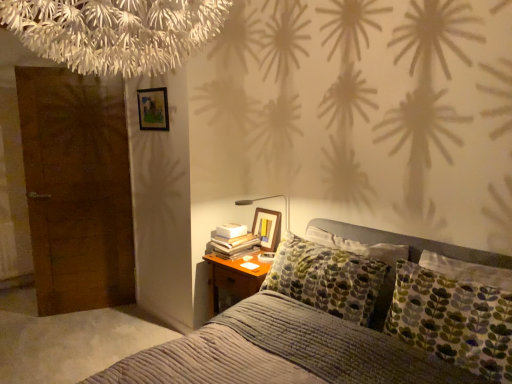
What do you see at coordinates (115, 32) in the screenshot? I see `white fringed chandelier at upper center` at bounding box center [115, 32].

Describe the element at coordinates (153, 109) in the screenshot. Image resolution: width=512 pixels, height=384 pixels. I see `wooden picture frame at upper left, acting as the 2th picture frame starting from the bottom` at that location.

Where is `textured gray bed at center`? textured gray bed at center is located at coordinates (281, 352).

Where is `brown wooden door at left`? This screenshot has height=384, width=512. brown wooden door at left is located at coordinates (77, 189).

You are a GUI agent. You are given a task and a screenshot of the screen. Output one action in this format:
    pyautogui.click(x=<x>, y=<y>)
    Task: Click on the white fringed chandelier at upper center
    Image resolution: width=512 pixels, height=384 pixels.
    Given the screenshot: What is the action you would take?
    pyautogui.click(x=115, y=32)

Considering the sizes of objects white paper book at bedside and textured gray bed at center in the image provided, who is wider, white paper book at bedside or textured gray bed at center?

With larger width is textured gray bed at center.

From a real-world perspective, who is located higher, white paper book at bedside or textured gray bed at center?

In real-world perspective, white paper book at bedside is above.

From the image's perspective, which is above, white paper book at bedside or textured gray bed at center?

white paper book at bedside appears higher in the image.

Between white paper book at bedside and textured gray bed at center, which one has less height?

With less height is white paper book at bedside.

Is textured gray bed at center outside of wooden picture frame at upper right, placed as the second picture frame when sorted from top to bottom?

That's correct, textured gray bed at center is outside of wooden picture frame at upper right, placed as the second picture frame when sorted from top to bottom.

Between textured gray bed at center and wooden picture frame at upper right, arranged as the 1th picture frame when ordered from the bottom, which one has larger width?

With larger width is textured gray bed at center.

Are textured gray bed at center and wooden picture frame at upper right, arranged as the 1th picture frame when ordered from the bottom, beside each other?

No, textured gray bed at center is not touching wooden picture frame at upper right, arranged as the 1th picture frame when ordered from the bottom.

This screenshot has width=512, height=384. Identify the location of bed that appears on the left of wooden picture frame at upper right, arranged as the 1th picture frame when ordered from the bottom. (281, 352).

Considering the relative positions of textured gray bed at center and wooden picture frame at upper left, placed as the 1th picture frame when sorted from left to right, in the image provided, is textured gray bed at center to the left of wooden picture frame at upper left, placed as the 1th picture frame when sorted from left to right, from the viewer's perspective?

No, textured gray bed at center is not to the left of wooden picture frame at upper left, placed as the 1th picture frame when sorted from left to right.

Does textured gray bed at center have a greater height compared to wooden picture frame at upper left, which appears as the first picture frame when viewed from the top?

Correct, textured gray bed at center is much taller as wooden picture frame at upper left, which appears as the first picture frame when viewed from the top.

Is textured gray bed at center bigger or smaller than wooden picture frame at upper left, placed as the 1th picture frame when sorted from left to right?

Considering their sizes, textured gray bed at center takes up more space than wooden picture frame at upper left, placed as the 1th picture frame when sorted from left to right.

In the scene shown: Between textured gray bed at center and wooden picture frame at upper left, which appears as the first picture frame when viewed from the top, which one is positioned behind?

Positioned behind is wooden picture frame at upper left, which appears as the first picture frame when viewed from the top.

Is white paper book at bedside next to wooden picture frame at upper left, which appears as the first picture frame when viewed from the top?

No, white paper book at bedside is not in contact with wooden picture frame at upper left, which appears as the first picture frame when viewed from the top.

Is the position of white paper book at bedside less distant than that of wooden picture frame at upper left, which appears as the first picture frame when viewed from the top?

Yes, white paper book at bedside is closer to the viewer.

Does white paper book at bedside have a lesser height compared to wooden picture frame at upper left, the second picture frame positioned from the right?

Yes.

What's the angular difference between white paper book at bedside and wooden picture frame at upper left, placed as the 1th picture frame when sorted from left to right,'s facing directions?

There is a 2.02-degree angle between the facing directions of white paper book at bedside and wooden picture frame at upper left, placed as the 1th picture frame when sorted from left to right.

In the scene shown: What's the angular difference between brown wooden door at left and wooden picture frame at upper right, arranged as the 1th picture frame when ordered from the bottom,'s facing directions?

The angular difference between brown wooden door at left and wooden picture frame at upper right, arranged as the 1th picture frame when ordered from the bottom, is 66.6 degrees.

Can you confirm if brown wooden door at left is bigger than wooden picture frame at upper right, arranged as the 1th picture frame when ordered from the bottom?

Yes.

From their relative heights in the image, would you say brown wooden door at left is taller or shorter than wooden picture frame at upper right, arranged as the 1th picture frame when ordered from the bottom?

brown wooden door at left is taller than wooden picture frame at upper right, arranged as the 1th picture frame when ordered from the bottom.

Which object is more forward, brown wooden door at left or wooden picture frame at upper right, arranged as the second picture frame when viewed from the left?

→ wooden picture frame at upper right, arranged as the second picture frame when viewed from the left.

Based on the photo, from the image's perspective, is textured gray bed at center located above or below brown wooden door at left?

From the image's perspective, textured gray bed at center appears below brown wooden door at left.

Is textured gray bed at center aimed at brown wooden door at left?

No, textured gray bed at center is not aimed at brown wooden door at left.

In terms of width, does textured gray bed at center look wider or thinner when compared to brown wooden door at left?

textured gray bed at center is wider than brown wooden door at left.

Which is more to the right, textured gray bed at center or brown wooden door at left?

Positioned to the right is textured gray bed at center.

From the image's perspective, which is above, white fringed chandelier at upper center or wooden picture frame at upper right, arranged as the 1th picture frame when ordered from the bottom?

white fringed chandelier at upper center.

Between white fringed chandelier at upper center and wooden picture frame at upper right, placed as the second picture frame when sorted from top to bottom, which one appears on the left side from the viewer's perspective?

From the viewer's perspective, white fringed chandelier at upper center appears more on the left side.

Is wooden picture frame at upper right, which is the 1th picture frame from right to left, at the back of white fringed chandelier at upper center?

That's not correct — white fringed chandelier at upper center is not looking away from wooden picture frame at upper right, which is the 1th picture frame from right to left.

Image resolution: width=512 pixels, height=384 pixels. In order to click on book on the left of the textured gray bed at center in this screenshot , I will do `click(233, 242)`.

There is a textured gray bed at center. Identify the location of the 1st picture frame above it (from a real-world perspective). (267, 228).

Looking at the image, which one is located closer to textured gray bed at center, wooden picture frame at upper right, which is the 1th picture frame from right to left, or white fringed chandelier at upper center?

The object closer to textured gray bed at center is wooden picture frame at upper right, which is the 1th picture frame from right to left.

Estimate the real-world distances between objects in this image. Which object is closer to brown wooden door at left, textured gray bed at center or wooden picture frame at upper left, the second picture frame positioned from the right?

wooden picture frame at upper left, the second picture frame positioned from the right, lies closer to brown wooden door at left than the other object.

Based on their spatial positions, is wooden picture frame at upper left, which appears as the first picture frame when viewed from the top, or textured gray bed at center closer to white fringed chandelier at upper center?

Among the two, textured gray bed at center is located nearer to white fringed chandelier at upper center.

From the image, which object appears to be nearer to wooden picture frame at upper left, placed as the 1th picture frame when sorted from left to right, textured gray bed at center or wooden picture frame at upper right, placed as the second picture frame when sorted from top to bottom?

Among the two, wooden picture frame at upper right, placed as the second picture frame when sorted from top to bottom, is located nearer to wooden picture frame at upper left, placed as the 1th picture frame when sorted from left to right.

Considering their positions, is wooden picture frame at upper right, arranged as the 1th picture frame when ordered from the bottom, positioned further to wooden picture frame at upper left, which appears as the first picture frame when viewed from the top, than brown wooden door at left?

The object further to wooden picture frame at upper left, which appears as the first picture frame when viewed from the top, is wooden picture frame at upper right, arranged as the 1th picture frame when ordered from the bottom.

Looking at the image, which one is located closer to wooden picture frame at upper left, acting as the 2th picture frame starting from the bottom, white paper book at bedside or textured gray bed at center?

Based on the image, white paper book at bedside appears to be nearer to wooden picture frame at upper left, acting as the 2th picture frame starting from the bottom.

From the picture: Considering their positions, is white fringed chandelier at upper center positioned further to wooden picture frame at upper right, arranged as the second picture frame when viewed from the left, than textured gray bed at center?

The object further to wooden picture frame at upper right, arranged as the second picture frame when viewed from the left, is white fringed chandelier at upper center.

When comparing their distances from textured gray bed at center, does white fringed chandelier at upper center or white paper book at bedside seem further?

white fringed chandelier at upper center.

Find the location of a particular element. This screenshot has width=512, height=384. picture frame located between textured gray bed at center and wooden picture frame at upper right, arranged as the 1th picture frame when ordered from the bottom, in the depth direction is located at coordinates (153, 109).

At what (x,y) coordinates should I click in order to perform the action: click on tree located between textured gray bed at center and white paper book at bedside in the depth direction. Please return your answer as a coordinate pair (x, y). The height and width of the screenshot is (384, 512). Looking at the image, I should click on (115, 32).

This screenshot has height=384, width=512. I want to click on book between brown wooden door at left and wooden picture frame at upper right, arranged as the 1th picture frame when ordered from the bottom, from left to right, so click(233, 242).

Find the location of a particular element. picture frame that lies between wooden picture frame at upper left, which appears as the first picture frame when viewed from the top, and white paper book at bedside from top to bottom is located at coordinates point(267,228).